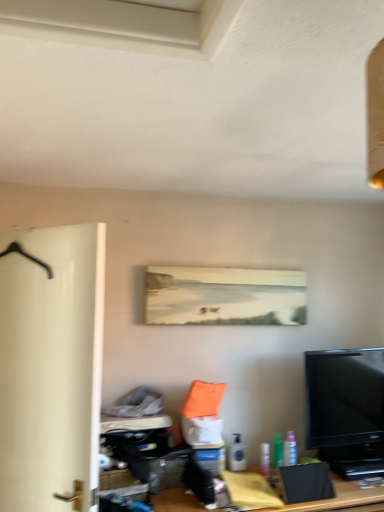
Identify the location of free space to the left of green plastic bottle at lower right, the second toiletry positioned from the right. (253, 471).